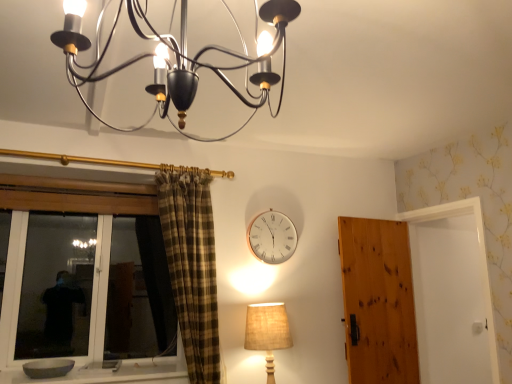
Question: Which direction should I rotate to look at metallic chandelier at upper center, which is counted as the 1th lamp, starting from the front, — up or down?

Choices:
 (A) down
 (B) up

Answer: (B)

Question: From a real-world perspective, is burlap beige lampshade at lower right, acting as the 1th lamp starting from the back, located beneath metallic chandelier at upper center, the 1th lamp from the top?

Choices:
 (A) no
 (B) yes

Answer: (B)

Question: Is burlap beige lampshade at lower right, the first lamp from the bottom, smaller than metallic chandelier at upper center, positioned as the second lamp in back-to-front order?

Choices:
 (A) no
 (B) yes

Answer: (B)

Question: Is burlap beige lampshade at lower right, the first lamp from the bottom, taller than metallic chandelier at upper center, positioned as the second lamp in back-to-front order?

Choices:
 (A) yes
 (B) no

Answer: (A)

Question: Is burlap beige lampshade at lower right, which ranks as the 2th lamp in front-to-back order, turned away from metallic chandelier at upper center, the 1th lamp from the top?

Choices:
 (A) yes
 (B) no

Answer: (B)

Question: Considering the relative sizes of burlap beige lampshade at lower right, acting as the 1th lamp starting from the back, and metallic chandelier at upper center, which is counted as the 1th lamp, starting from the front, in the image provided, is burlap beige lampshade at lower right, acting as the 1th lamp starting from the back, wider than metallic chandelier at upper center, which is counted as the 1th lamp, starting from the front,?

Choices:
 (A) no
 (B) yes

Answer: (A)

Question: Can you confirm if burlap beige lampshade at lower right, acting as the 1th lamp starting from the back, is bigger than metallic chandelier at upper center, positioned as the second lamp in back-to-front order?

Choices:
 (A) yes
 (B) no

Answer: (B)

Question: Could you tell me if burlap beige lampshade at lower right, the first lamp from the bottom, is facing wooden door at right?

Choices:
 (A) no
 (B) yes

Answer: (A)

Question: Is the depth of burlap beige lampshade at lower right, which ranks as the 2th lamp in front-to-back order, less than that of wooden door at right?

Choices:
 (A) yes
 (B) no

Answer: (A)

Question: Is burlap beige lampshade at lower right, acting as the 1th lamp starting from the back, not near wooden door at right?

Choices:
 (A) yes
 (B) no

Answer: (B)

Question: From the image's perspective, would you say burlap beige lampshade at lower right, which ranks as the 2th lamp in front-to-back order, is shown under wooden door at right?

Choices:
 (A) no
 (B) yes

Answer: (B)

Question: Is burlap beige lampshade at lower right, the first lamp from the bottom, behind wooden door at right?

Choices:
 (A) no
 (B) yes

Answer: (A)

Question: From a real-world perspective, is burlap beige lampshade at lower right, the 2th lamp when ordered from top to bottom, below wooden door at right?

Choices:
 (A) yes
 (B) no

Answer: (A)

Question: Could you tell me if gray stone bowl at lower left is turned towards metallic chandelier at upper center, the 1th lamp from the top?

Choices:
 (A) no
 (B) yes

Answer: (A)